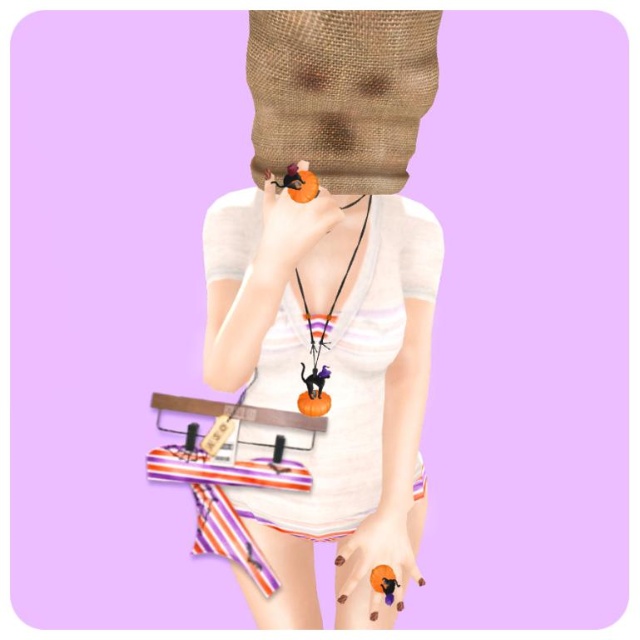
Question: Which object appears farthest from the camera in this image?

Choices:
 (A) matte orange ring at center
 (B) matte black cat at center

Answer: (B)

Question: Does matte white shirt at center appear on the right side of matte orange ring at center?

Choices:
 (A) yes
 (B) no

Answer: (A)

Question: Which object is positioned closest to the matte orange ring at center?

Choices:
 (A) matte white shirt at center
 (B) matte orange ring at lower center

Answer: (A)

Question: Does matte orange ring at center have a smaller size compared to matte black cat at center?

Choices:
 (A) no
 (B) yes

Answer: (B)

Question: Which object appears farthest from the camera in this image?

Choices:
 (A) matte black cat at center
 (B) matte orange ring at lower center
 (C) matte orange ring at center
 (D) matte white shirt at center

Answer: (B)

Question: Is matte orange ring at lower center positioned at the back of matte black cat at center?

Choices:
 (A) no
 (B) yes

Answer: (B)